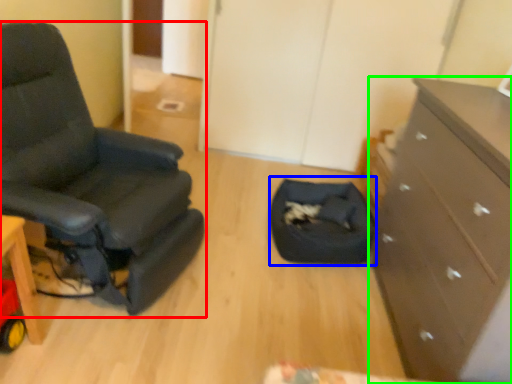
Question: Which is nearer to the chair (highlighted by a red box)? footrest (highlighted by a blue box) or chest of drawers (highlighted by a green box).

Choices:
 (A) footrest
 (B) chest of drawers

Answer: (A)